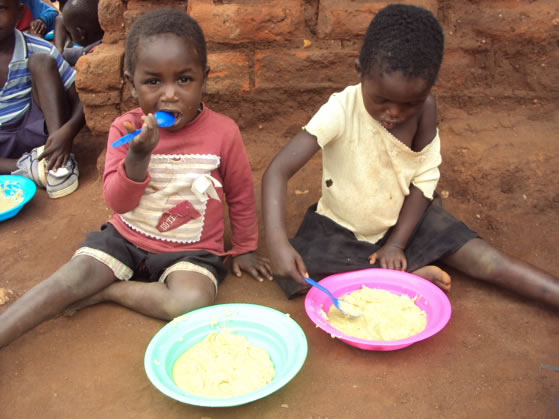
Identify the location of pink plate. (445, 311).